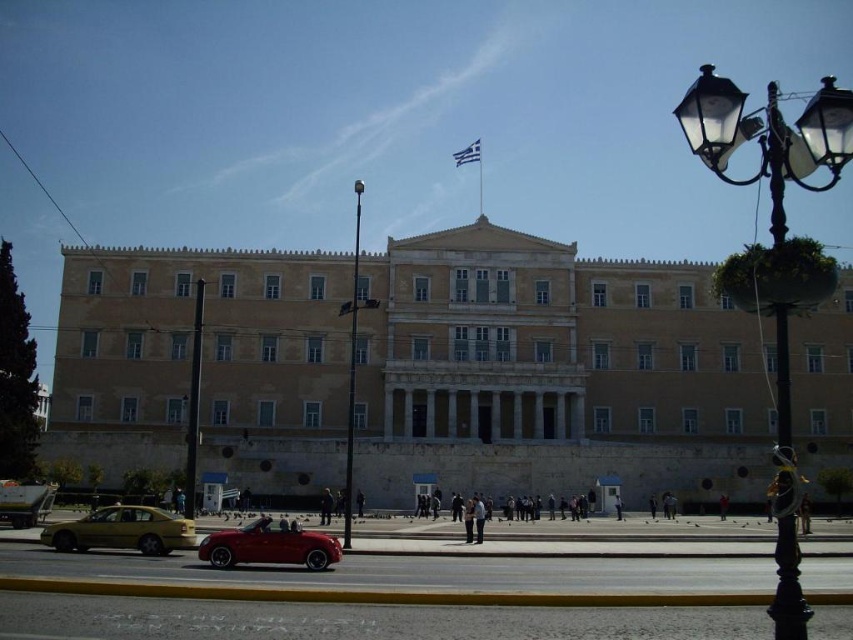
You are a visitor standing at the entrance of the grand neoclassical building and want to take a photo of both the yellow matte sedan at lower left and the shiny red convertible at center. Which car should you move closer to in order to capture both in the same frame?

You should move closer to the shiny red convertible at center because the yellow matte sedan at lower left is closer to you already, so adjusting your position towards the farther car can help include both in the frame.

You are a tour guide explaining the scene to visitors. You mention the yellow matte sedan at lower left and the shiny red convertible at center. Which vehicle has a greater width?

The yellow matte sedan at lower left has a greater width than the shiny red convertible at center.